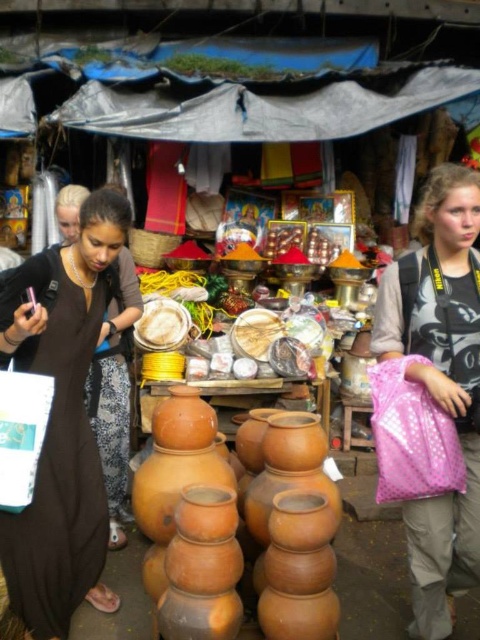
Does point (199, 481) come farther from viewer compared to point (175, 342)?

That is False.

Between point (154, 548) and point (178, 301), which one is positioned in front?

Point (154, 548) is in front.

Does point (192, 426) come farther from viewer compared to point (154, 304)?

No, it is in front of (154, 304).

You are a GUI agent. You are given a task and a screenshot of the screen. Output one action in this format:
    pyautogui.click(x=<x>, y=<y>)
    Task: Click on the matte clay pots at center
    The width and height of the screenshot is (480, 640).
    Given the screenshot: What is the action you would take?
    pyautogui.click(x=177, y=461)

Is matte black dress at center thinner than pink shiny bag at lower right?

In fact, matte black dress at center might be wider than pink shiny bag at lower right.

Measure the distance between matte black dress at center and camera.

They are 7.46 feet apart.

Does point (52, 305) come behind point (444, 288)?

No, (52, 305) is closer to viewer.

I want to click on matte black dress at center, so click(x=62, y=419).

Can you confirm if matte black dress at center is positioned to the left of white powder at center?

Indeed, matte black dress at center is positioned on the left side of white powder at center.

Who is taller, matte black dress at center or white powder at center?

matte black dress at center

Between point (87, 474) and point (156, 321), which one is positioned behind?

Positioned behind is point (156, 321).

This screenshot has height=640, width=480. I want to click on matte black dress at center, so click(62, 419).